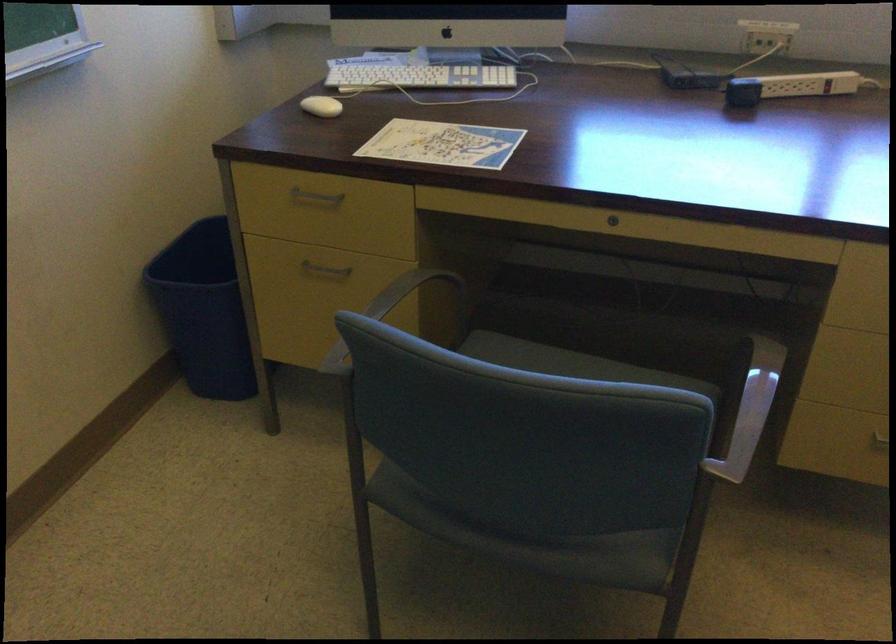
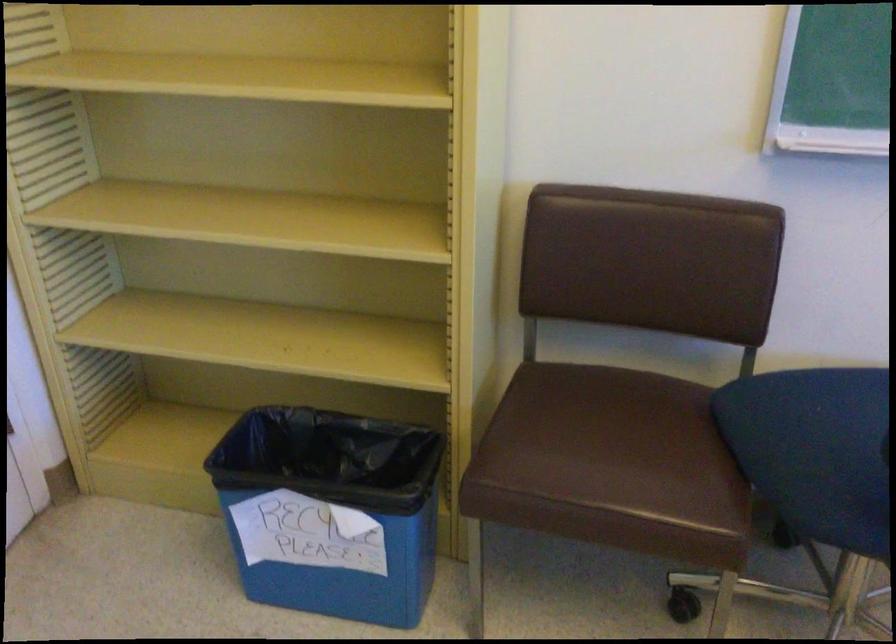
The first image is from the beginning of the video and the second image is from the end. How did the camera likely rotate when shooting the video?

The camera rotated toward left-down.